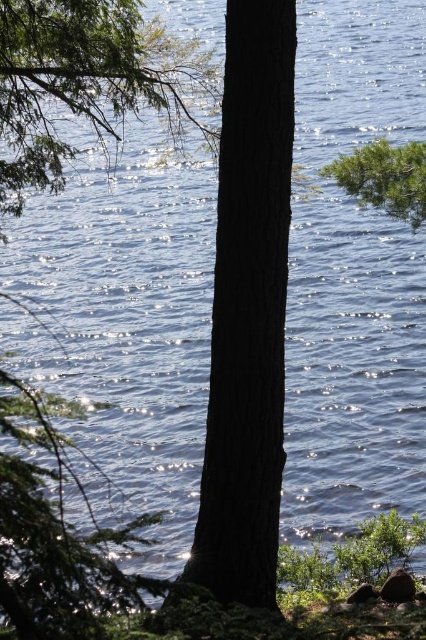
You are standing at coordinates 0,0 and want to reach the smooth bark tree at center. What direction should you move in to get there?

The smooth bark tree at center is located at coordinates [247,310], so you should move in the positive x and positive y direction to reach it.

You are a hiker standing at the lakeside and want to take a photo of both the smooth bark tree at center and the green matte tree trunk at center. Which tree should you position yourself to the left of to include both in your shot?

You should position yourself to the left of the green matte tree trunk at center because the smooth bark tree at center is to the right of it, allowing both trees to be captured in the frame.